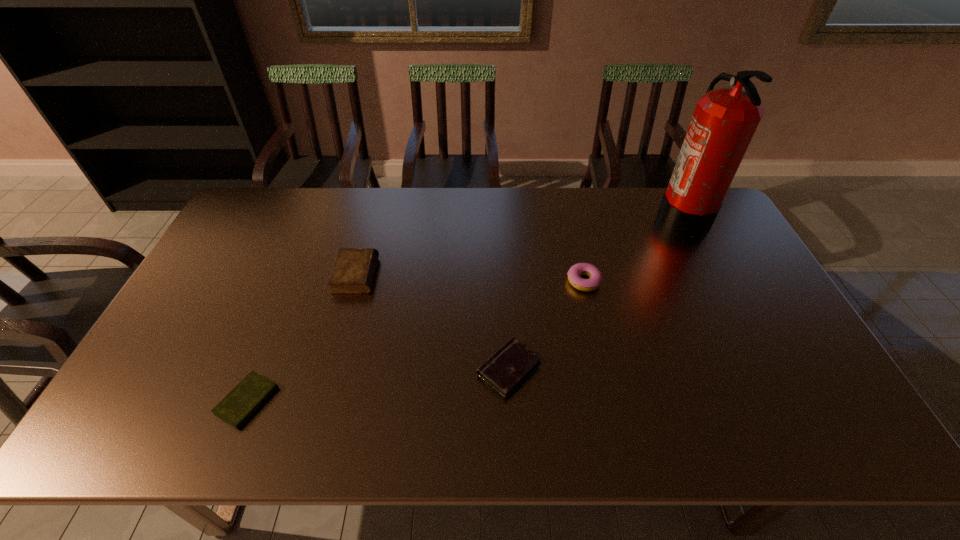
The image size is (960, 540). What are the coordinates of `vacant region located 0.350m on the front side of the tallest object` in the screenshot? It's located at (559, 215).

Locate an element on the screen. vacant space located on the front side of the tallest object is located at coordinates click(610, 215).

At what (x,y) coordinates should I click in order to perform the action: click on vacant space located on the spine side of the tallest diary. Please return your answer as a coordinate pair (x, y). The height and width of the screenshot is (540, 960). Looking at the image, I should click on (474, 275).

Identify the location of free spot located 0.320m on the right of the doughnut. (708, 281).

This screenshot has width=960, height=540. In order to click on vacant region located on the back of the rightmost diary in this screenshot , I will do `click(503, 254)`.

Identify the location of free spot located on the right of the leftmost object. (393, 401).

The image size is (960, 540). I want to click on object at the far edge, so click(x=724, y=121).

Identify the location of object that is at the near edge. This screenshot has height=540, width=960. (241, 403).

Locate an element on the screen. The height and width of the screenshot is (540, 960). object at the right edge is located at coordinates (724, 121).

At what (x,y) coordinates should I click in order to perform the action: click on object that is positioned at the far right corner. Please return your answer as a coordinate pair (x, y). This screenshot has width=960, height=540. Looking at the image, I should click on (724, 121).